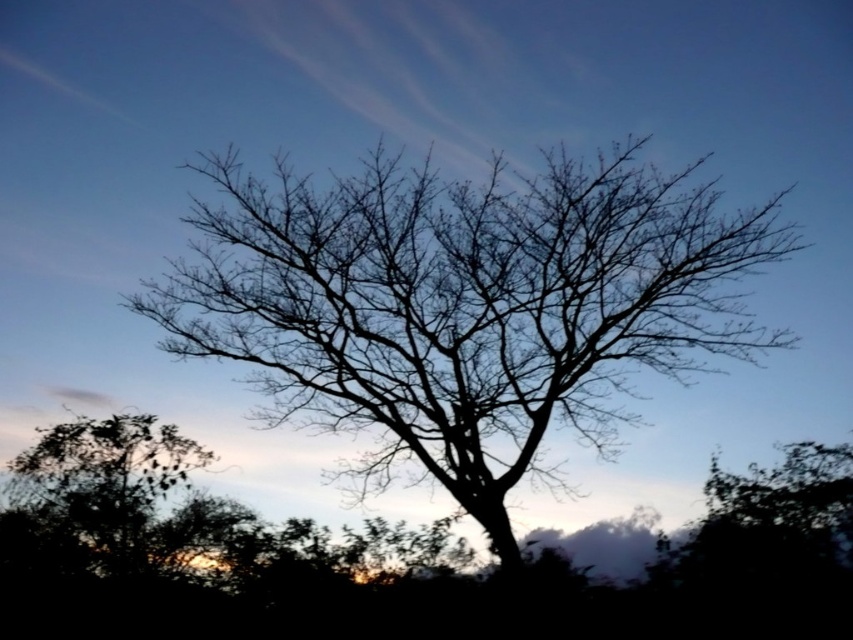
Question: Where is silhouette bark tree at center located in relation to green leafy tree at lower left in the image?

Choices:
 (A) left
 (B) right

Answer: (B)

Question: Can you confirm if silhouette bark tree at center is positioned to the right of green leafy tree at lower left?

Choices:
 (A) yes
 (B) no

Answer: (A)

Question: Is silhouette bark tree at center to the right of green leafy tree at lower left from the viewer's perspective?

Choices:
 (A) no
 (B) yes

Answer: (B)

Question: Among these points, which one is farthest from the camera?

Choices:
 (A) (523, 241)
 (B) (109, 461)

Answer: (B)

Question: Which of the following is the farthest from the observer?

Choices:
 (A) 618,396
 (B) 151,426

Answer: (B)